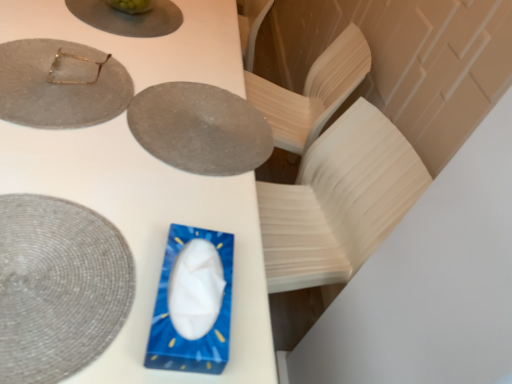
The height and width of the screenshot is (384, 512). In order to click on vacant area that is in front of matte gray plate at upper center, the second plate positioned from the bottom in this screenshot , I will do `click(151, 189)`.